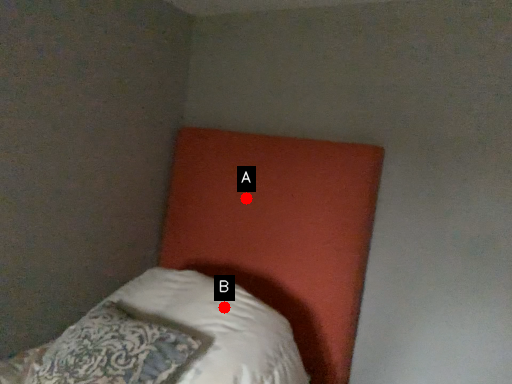
Question: Two points are circled on the image, labeled by A and B beside each circle. Among these points, which one is nearest to the camera?

Choices:
 (A) A is closer
 (B) B is closer

Answer: (B)